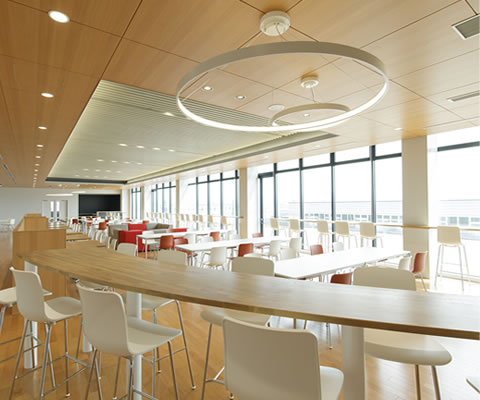
I want to click on counter tops, so click(294, 295), click(71, 233), click(58, 222), click(81, 251).